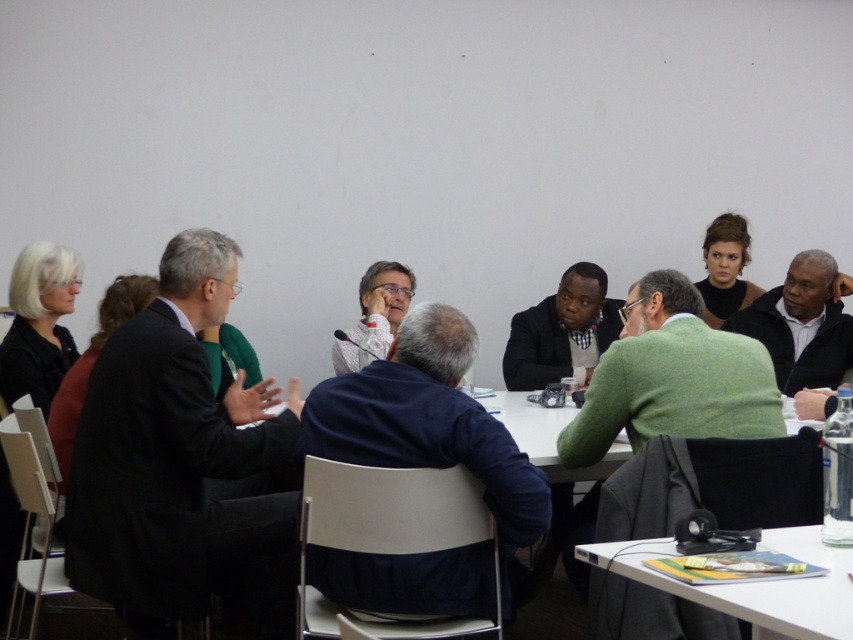
You are standing in the room and want to place a new object on the white plastic table at lower right. According to the coordinates provided in the Objects Description, where exactly should you position the table?

The white plastic table at lower right should be positioned at coordinates point (752,582) as specified in the Objects Description.

You are organizing a meeting and need to place a 12 inch wide laptop on the table. Considering the sizes of the white plastic table at lower right and the white shirt at center, which table can accommodate the laptop?

The white shirt at center is larger than the white plastic table at lower right, so the laptop should be placed on the white shirt at center to ensure it fits properly.